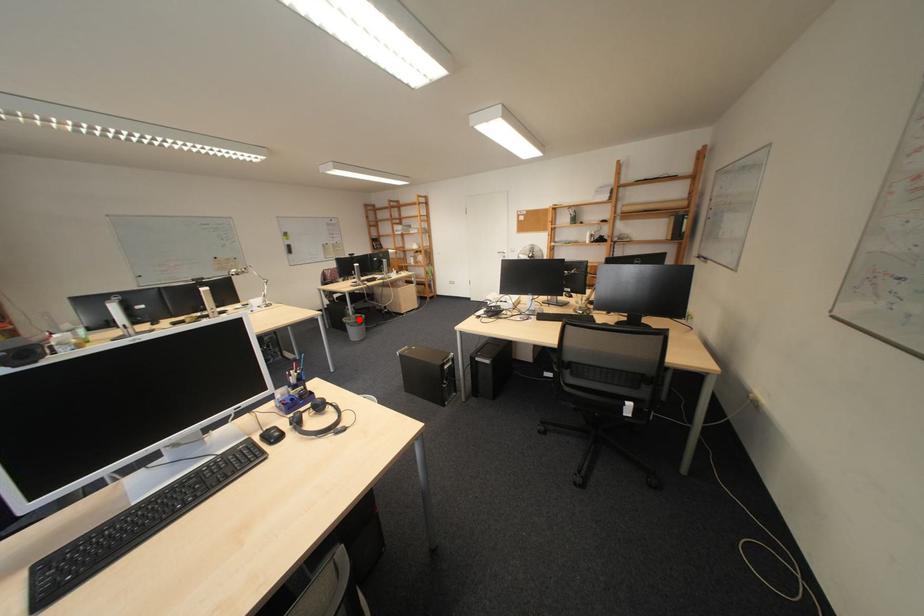
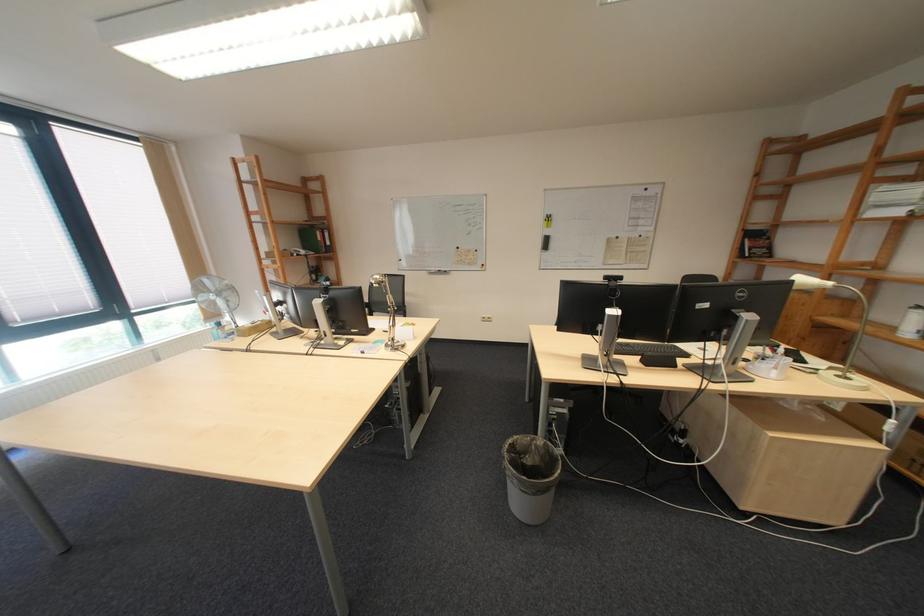
Find the pixel in the second image that matches the highlighted location in the first image.

(529, 439)